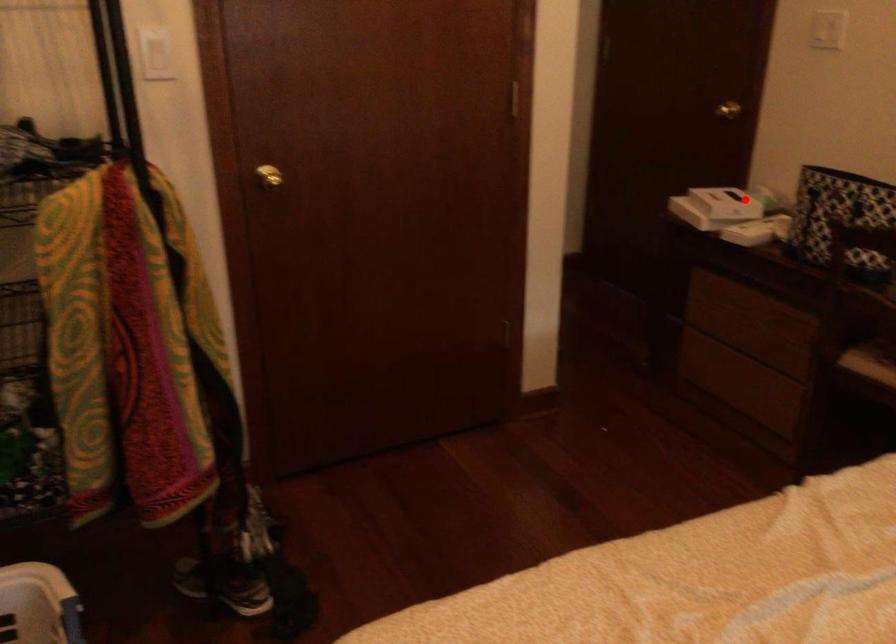
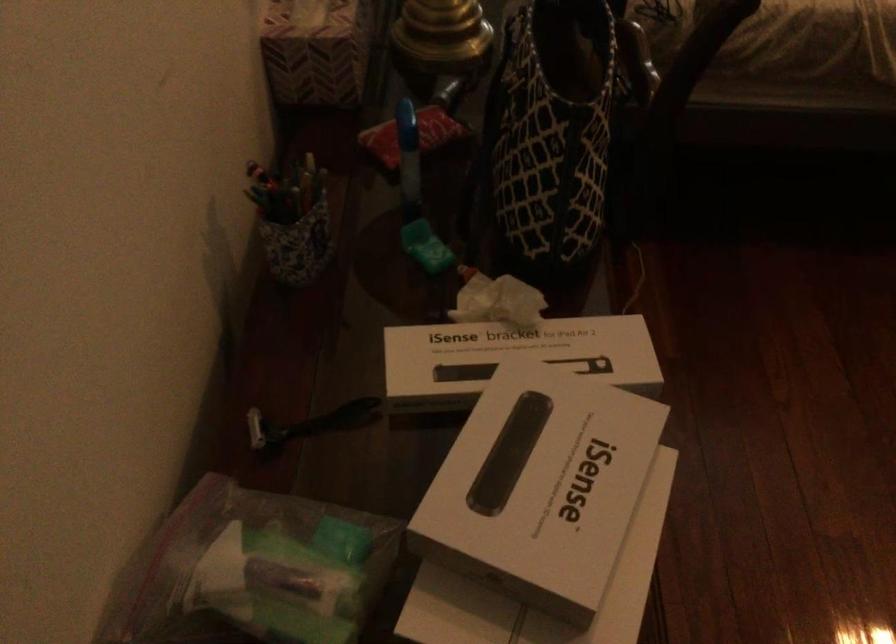
Question: I am providing you with two images of the same scene from different viewpoints. Image1 has a red point marked. In image2, the corresponding 3D location appears at what relative position? Reply with the corresponding letter.

Choices:
 (A) Closer
 (B) Farther

Answer: (A)